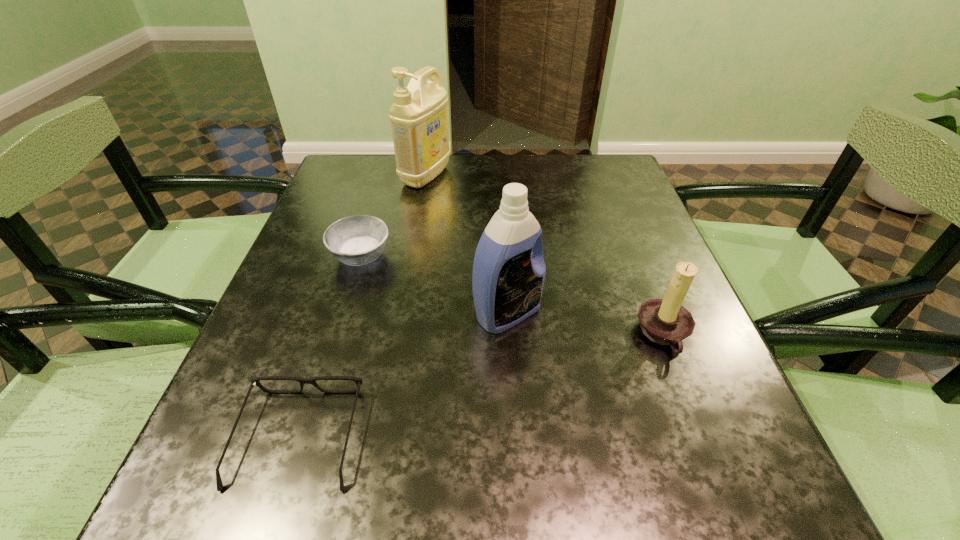
This screenshot has height=540, width=960. Identify the location of free space at the far right corner. (600, 174).

Identify the location of vacant space that is in between the shortest object and the right detergent. (403, 375).

Identify the location of vacant area that lies between the right detergent and the second farthest object. This screenshot has width=960, height=540. (434, 284).

This screenshot has height=540, width=960. Identify the location of vacant space that's between the spectacles and the farthest object. (362, 307).

Where is `free space that is in between the left detergent and the spectacles`? Image resolution: width=960 pixels, height=540 pixels. free space that is in between the left detergent and the spectacles is located at coordinates (362, 307).

Identify the location of vacant space that is in between the fourth nearest object and the right detergent. This screenshot has width=960, height=540. (434, 284).

At what (x,y) coordinates should I click in order to perform the action: click on vacant area that lies between the left detergent and the candle holder. Please return your answer as a coordinate pair (x, y). The width and height of the screenshot is (960, 540). Looking at the image, I should click on (545, 255).

Where is `empty space between the ashtray and the second object from right to left`? This screenshot has width=960, height=540. empty space between the ashtray and the second object from right to left is located at coordinates (434, 284).

You are a GUI agent. You are given a task and a screenshot of the screen. Output one action in this format:
    pyautogui.click(x=<x>, y=<y>)
    Task: Click on the vacant space that is in between the farthest object and the second shortest object
    
    Given the screenshot: What is the action you would take?
    tap(394, 216)

What are the coordinates of `vacant point located between the farther detergent and the nearer detergent` in the screenshot? It's located at (467, 245).